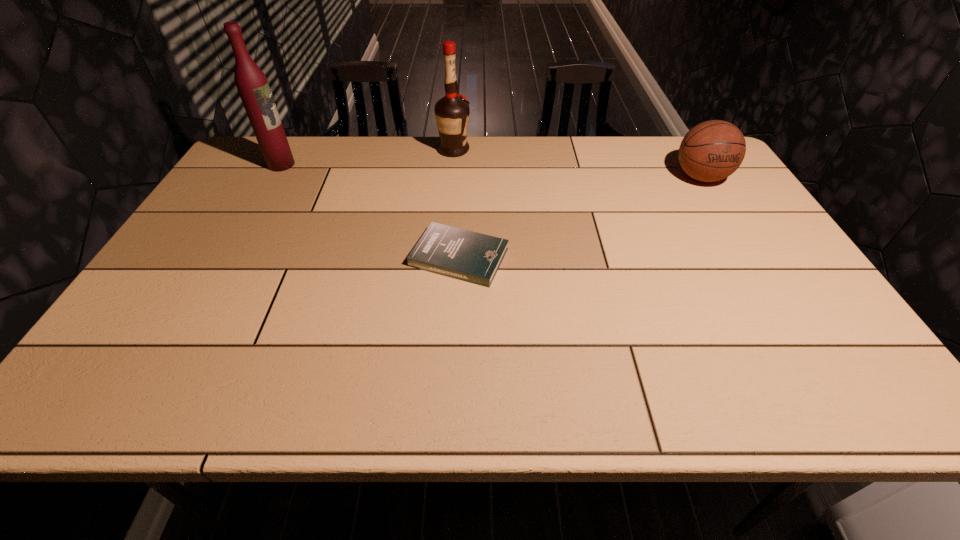
This screenshot has width=960, height=540. Identify the location of vacant area in the image that satisfies the following two spatial constraints: 1. on the front and back of the book; 2. on the left side of the second tallest object. (445, 257).

The image size is (960, 540). I want to click on free space that satisfies the following two spatial constraints: 1. on the front and back of the third shortest object; 2. on the back side of the nearest object, so click(445, 257).

I want to click on free location that satisfies the following two spatial constraints: 1. on the back side of the book; 2. on the front and back of the shorter liquor, so click(465, 150).